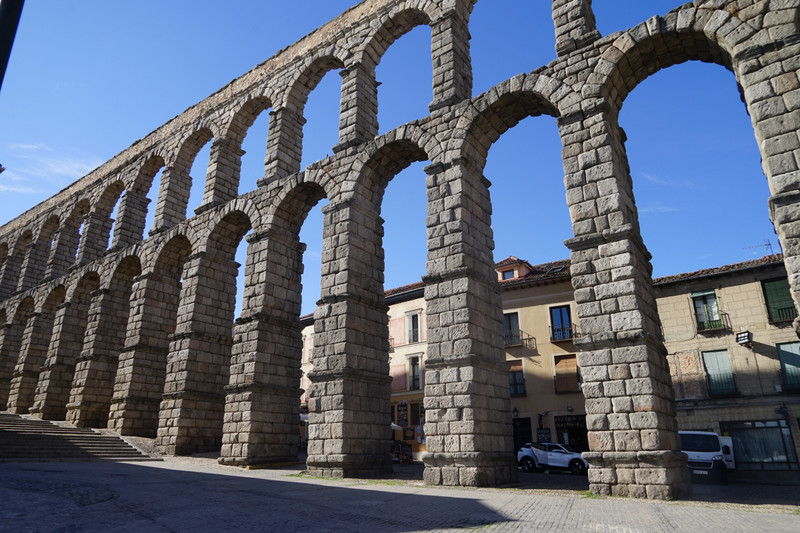
Where is `floor`? Image resolution: width=800 pixels, height=533 pixels. floor is located at coordinates (686, 526).